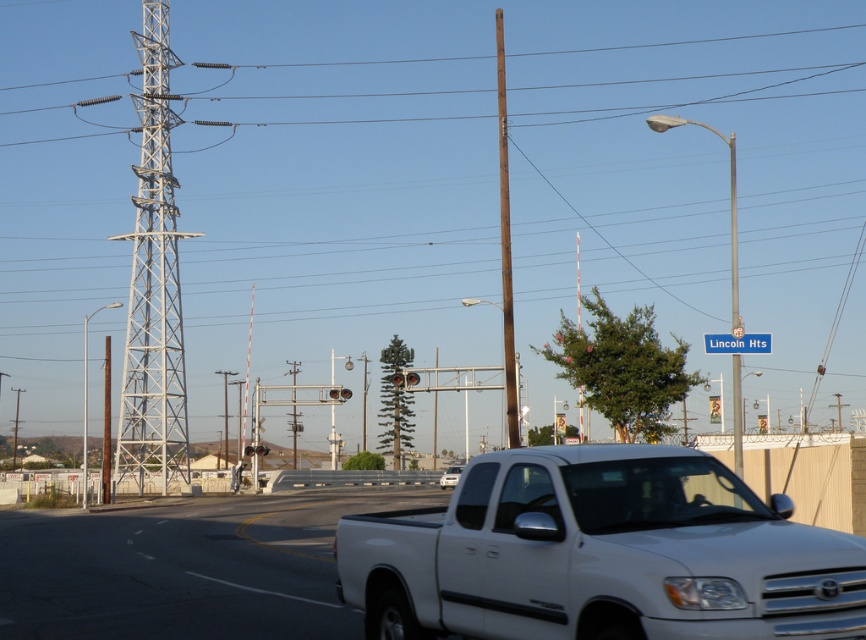
Question: Which point is farther to the camera?

Choices:
 (A) (270, 513)
 (B) (506, 376)
 (C) (176, 336)
 (D) (466, 557)

Answer: (C)

Question: Observing the image, what is the correct spatial positioning of white glossy highway at lower right in reference to white metallic tower at left?

Choices:
 (A) left
 (B) right

Answer: (B)

Question: Is white matte pickup truck at center positioned before white glossy highway at lower right?

Choices:
 (A) no
 (B) yes

Answer: (A)

Question: Which of the following is the farthest from the observer?

Choices:
 (A) blue plastic street sign at upper right
 (B) white matte pickup truck at center
 (C) white metallic tower at left
 (D) brown wooden pole at center

Answer: (C)

Question: Can you confirm if white metallic tower at left is positioned below brown wooden pole at center?

Choices:
 (A) yes
 (B) no

Answer: (A)

Question: Which point is closer to the camera?

Choices:
 (A) white glossy highway at lower right
 (B) white metallic tower at left
 (C) brown wooden pole at center
 (D) white matte pickup truck at center

Answer: (C)